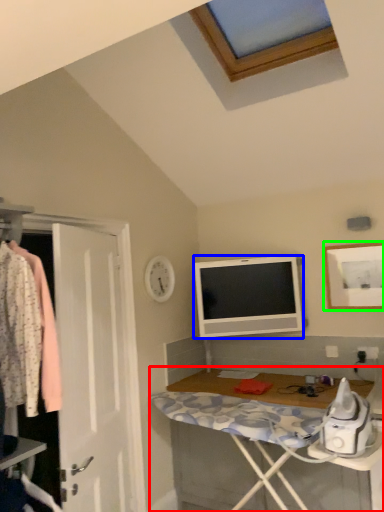
Question: Which object is positioned farthest from desk (highlighted by a red box)? Select from television (highlighted by a blue box) and picture frame (highlighted by a green box).

Choices:
 (A) television
 (B) picture frame

Answer: (B)